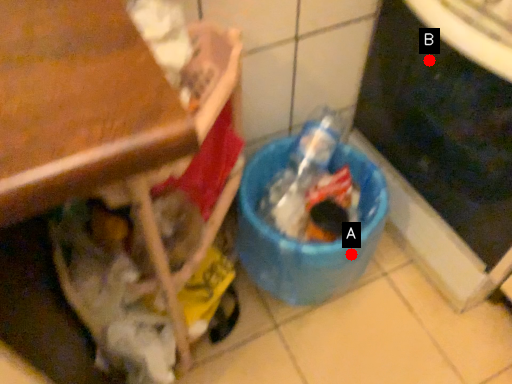
Question: Two points are circled on the image, labeled by A and B beside each circle. Which of the following is the farthest from the observer?

Choices:
 (A) A is further
 (B) B is further

Answer: (A)